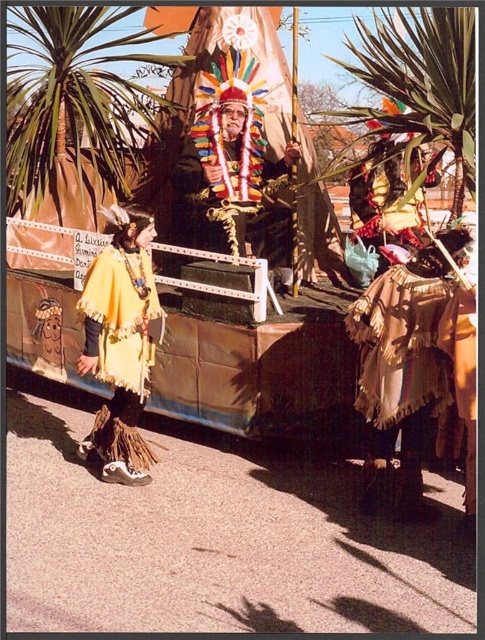
You are a photographer at the event and want to capture a photo that includes both the multicolored feather headdress at center and the yellow fabric headdress at center. Which headdress should you focus on first to ensure it appears larger in the photo?

The multicolored feather headdress at center is larger in size than the yellow fabric headdress at center, so focusing on it first will ensure it appears larger in the photo.

You are standing at the front of the parade route and notice the green leafy palm tree at upper right in the background. If you want to take a photo that includes both the parade participants and the palm tree without moving, which direction should you face?

The green leafy palm tree at upper right is 14.38 feet away from the viewer, so you should face towards the upper right direction to include both the parade participants and the palm tree in your photo without moving.

You are a photographer at the parade and want to capture both the multicolored feather headdress at center and the yellow fabric headdress at center in the same photo. Given that your camera has a maximum focus range of 6 feet, will you be able to include both in a single shot?

The multicolored feather headdress at center and yellow fabric headdress at center are 6.26 feet apart, which exceeds the camera maximum focus range of 6 feet. Therefore, it won